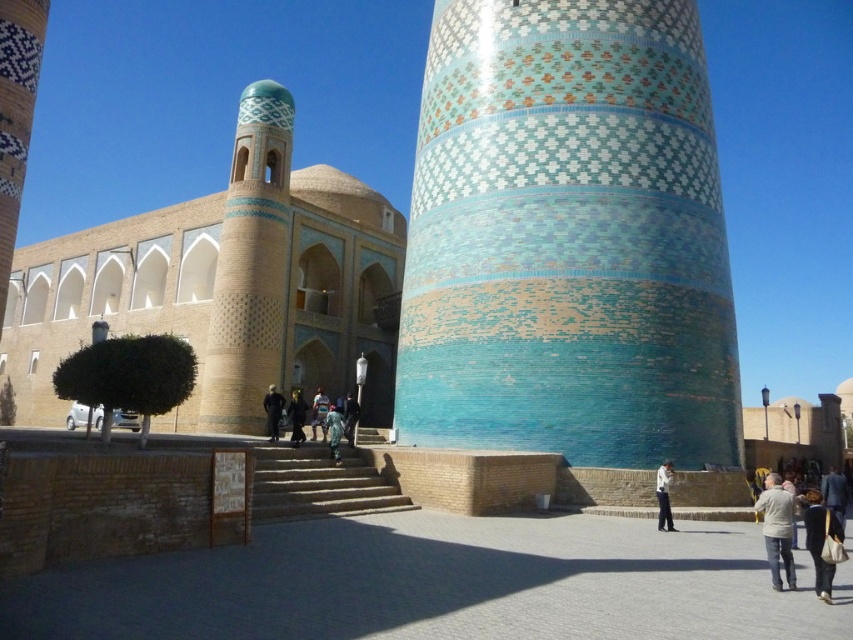
Question: Which object is closer to the camera taking this photo?

Choices:
 (A) dark blue suit at lower right
 (B) leather handbag at lower right
 (C) dark blue fabric at center
 (D) white cotton shirt at lower center

Answer: (B)

Question: Which is nearer to the green fabric dress at center?

Choices:
 (A) light gray fabric jacket at lower right
 (B) leather handbag at lower right
 (C) dark blue suit at lower right

Answer: (A)

Question: Which object appears farthest from the camera in this image?

Choices:
 (A) dark blue fabric at center
 (B) dark blue suit at lower right
 (C) glazed ceramic tower at center

Answer: (A)

Question: Can you confirm if light gray fabric jacket at lower right is positioned to the left of dark blue suit at lower right?

Choices:
 (A) no
 (B) yes

Answer: (B)

Question: Can you confirm if light blue denim jeans at center is positioned to the left of blue fabric dress at center?

Choices:
 (A) yes
 (B) no

Answer: (A)

Question: Considering the relative positions of dark blue suit at lower right and dark blue fabric at center in the image provided, where is dark blue suit at lower right located with respect to dark blue fabric at center?

Choices:
 (A) above
 (B) below

Answer: (B)